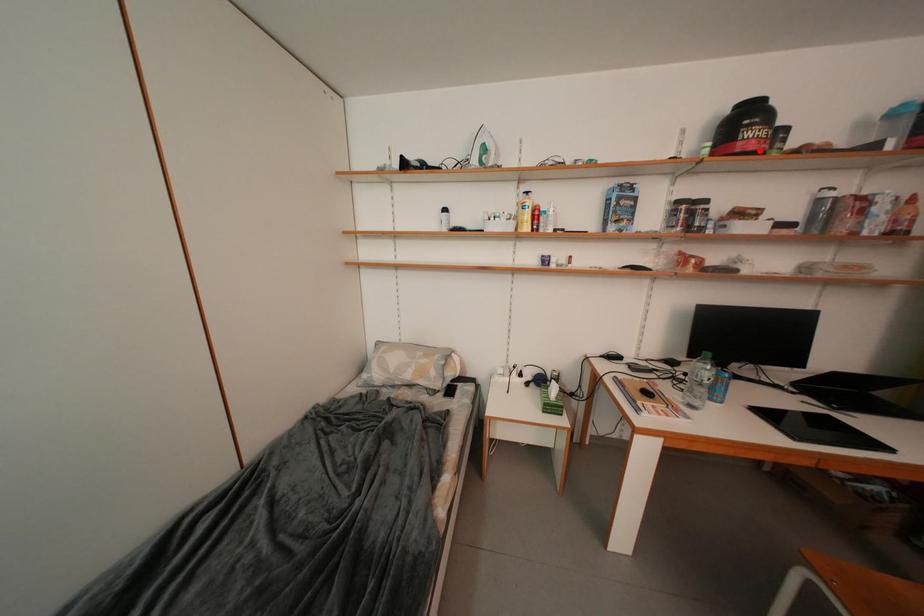
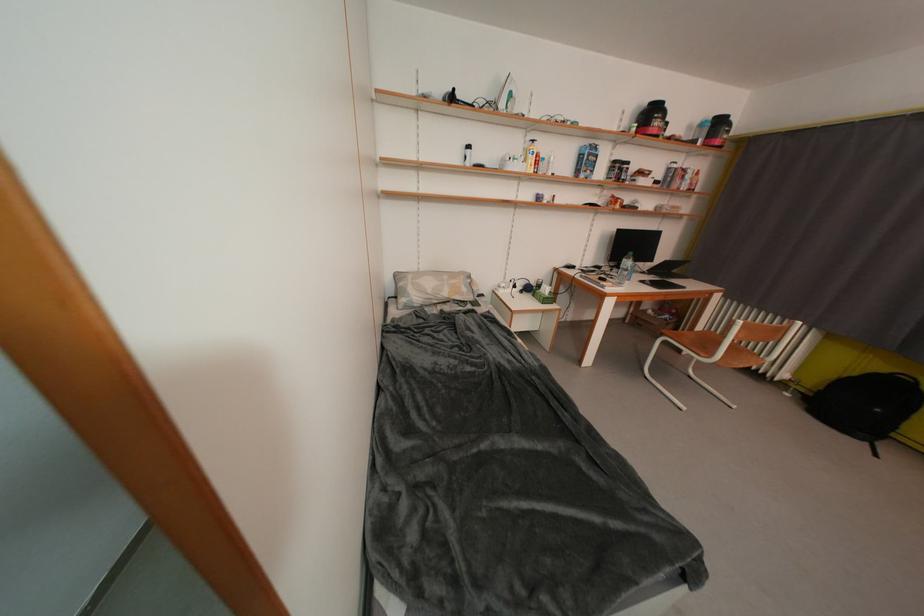
In the second image, find the point that corresponds to the highlighted location in the first image.

(663, 136)